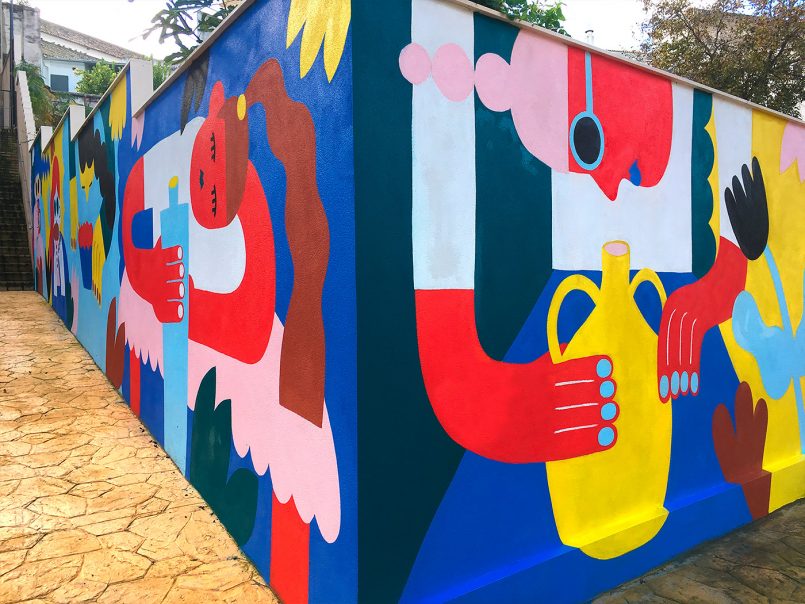
Locate an element on the screen. The height and width of the screenshot is (604, 805). corner where two wall sides meet is located at coordinates (353, 345).